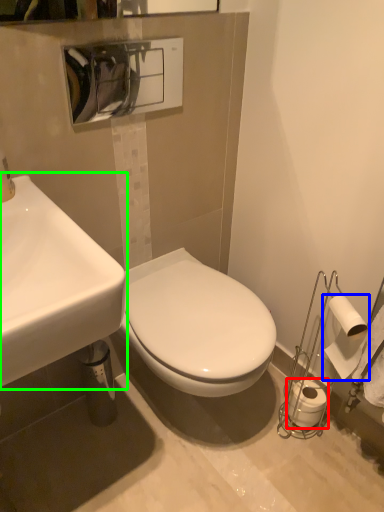
Question: Which is nearer to the toilet paper (highlighted by a red box)? toilet paper (highlighted by a blue box) or sink (highlighted by a green box).

Choices:
 (A) toilet paper
 (B) sink

Answer: (A)